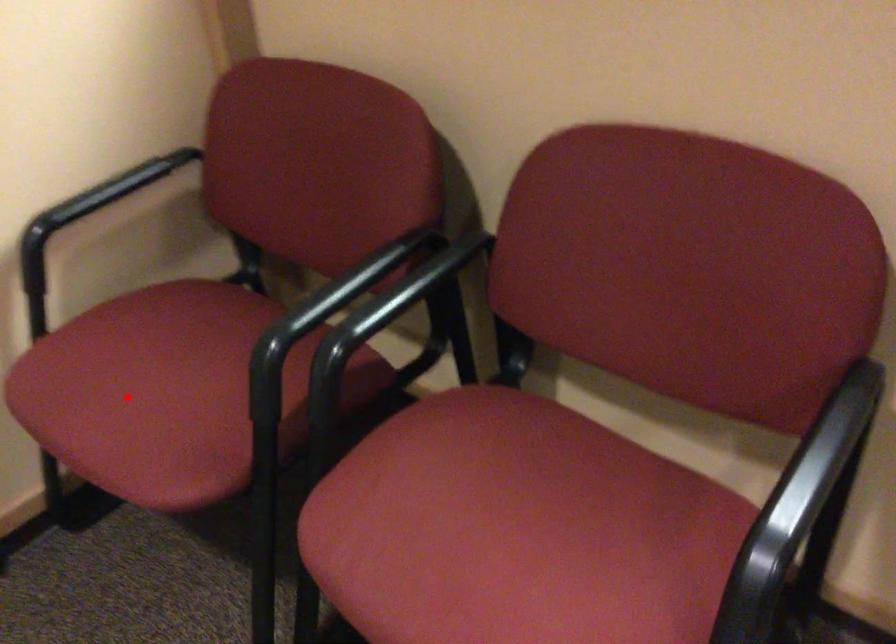
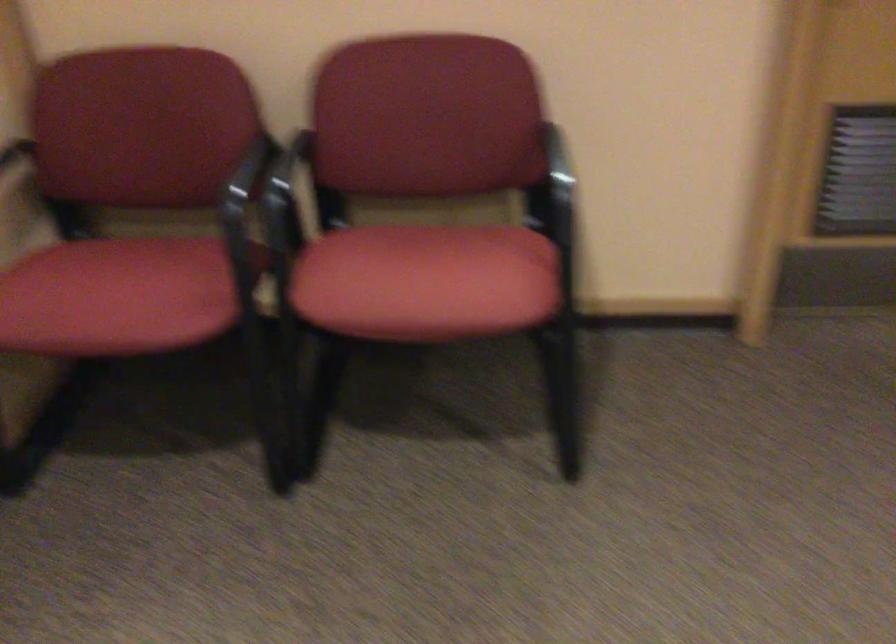
Question: I am providing you with two images of the same scene from different viewpoints. Given a red point in image1, look at the same physical point in image2. Is it:

Choices:
 (A) Closer to the viewpoint
 (B) Farther from the viewpoint

Answer: (B)